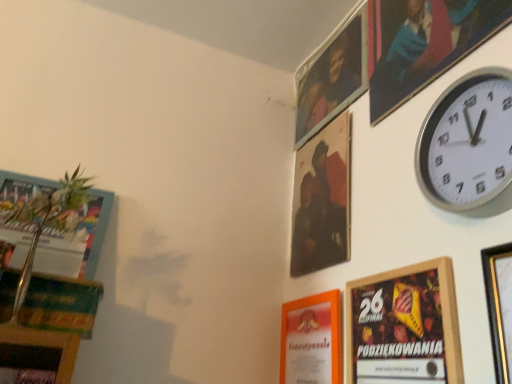
Find the location of a particular element. The width and height of the screenshot is (512, 384). gold metallic picture frame at upper right, which is the 6th picture frame from back to front is located at coordinates (499, 306).

I want to click on metallic silver picture frame at upper right, the sixth picture frame in the front-to-back sequence, so click(332, 75).

The image size is (512, 384). What do you see at coordinates (424, 43) in the screenshot?
I see `wooden picture frame at upper right, the fourth picture frame positioned from the back` at bounding box center [424, 43].

Describe the element at coordinates (467, 141) in the screenshot. Image resolution: width=512 pixels, height=384 pixels. I see `silver metallic wall clock at upper right` at that location.

Image resolution: width=512 pixels, height=384 pixels. I want to click on orange paper at lower center, placed as the 3th picture frame when sorted from back to front, so click(312, 340).

Describe the element at coordinates (312, 340) in the screenshot. I see `orange paper at lower center, the 4th picture frame from the front` at that location.

Identify the location of gold metallic picture frame at upper right, which is the 6th picture frame from back to front. This screenshot has width=512, height=384. (499, 306).

Is point (464, 30) behind point (318, 220)?

That is False.

Can you see wooden picture frame at upper right, which appears as the 3th picture frame when viewed from the front, touching matte black portrait at upper center, which appears as the 2th picture frame when viewed from the back?

No, wooden picture frame at upper right, which appears as the 3th picture frame when viewed from the front, is not next to matte black portrait at upper center, which appears as the 2th picture frame when viewed from the back.

Could matte black portrait at upper center, which appears as the 2th picture frame when viewed from the back, be considered to be inside wooden picture frame at upper right, which appears as the 3th picture frame when viewed from the front?

No, matte black portrait at upper center, which appears as the 2th picture frame when viewed from the back, is located outside of wooden picture frame at upper right, which appears as the 3th picture frame when viewed from the front.

Does point (349, 85) come closer to viewer compared to point (336, 322)?

No, it is behind (336, 322).

Is metallic silver picture frame at upper right, the sixth picture frame in the front-to-back sequence, not close to orange paper at lower center, placed as the 3th picture frame when sorted from back to front?

No, metallic silver picture frame at upper right, the sixth picture frame in the front-to-back sequence, is not far away from orange paper at lower center, placed as the 3th picture frame when sorted from back to front.

Between metallic silver picture frame at upper right, which is the first picture frame from back to front, and orange paper at lower center, the 4th picture frame from the front, which one has more height?

With more height is orange paper at lower center, the 4th picture frame from the front.

Considering the sizes of metallic silver picture frame at upper right, the sixth picture frame in the front-to-back sequence, and orange paper at lower center, placed as the 3th picture frame when sorted from back to front, in the image, is metallic silver picture frame at upper right, the sixth picture frame in the front-to-back sequence, wider or thinner than orange paper at lower center, placed as the 3th picture frame when sorted from back to front,?

Considering their sizes, metallic silver picture frame at upper right, the sixth picture frame in the front-to-back sequence, looks broader than orange paper at lower center, placed as the 3th picture frame when sorted from back to front.

Which object is further away from the camera, orange paper at lower center, the 4th picture frame from the front, or wooden framed poster at lower right, placed as the 2th picture frame when sorted from front to back?

orange paper at lower center, the 4th picture frame from the front, is further from the camera.

Between point (333, 320) and point (359, 298), which one is positioned in front?

Positioned in front is point (359, 298).

From a real-world perspective, is orange paper at lower center, the 4th picture frame from the front, physically above wooden framed poster at lower right, which appears as the 5th picture frame when viewed from the back?

Actually, orange paper at lower center, the 4th picture frame from the front, is physically below wooden framed poster at lower right, which appears as the 5th picture frame when viewed from the back, in the real world.

Which of these two, orange paper at lower center, the 4th picture frame from the front, or wooden framed poster at lower right, which appears as the 5th picture frame when viewed from the back, is wider?

orange paper at lower center, the 4th picture frame from the front.

Is metallic silver picture frame at upper right, which is the first picture frame from back to front, aimed at silver metallic wall clock at upper right?

No, metallic silver picture frame at upper right, which is the first picture frame from back to front, is not turned towards silver metallic wall clock at upper right.

In the scene shown: Which of these two, metallic silver picture frame at upper right, the sixth picture frame in the front-to-back sequence, or silver metallic wall clock at upper right, is thinner?

With smaller width is metallic silver picture frame at upper right, the sixth picture frame in the front-to-back sequence.

Is metallic silver picture frame at upper right, the sixth picture frame in the front-to-back sequence, next to silver metallic wall clock at upper right?

No, metallic silver picture frame at upper right, the sixth picture frame in the front-to-back sequence, is not in contact with silver metallic wall clock at upper right.

Consider the image. Is wooden picture frame at upper right, which appears as the 3th picture frame when viewed from the front, positioned with its back to silver metallic wall clock at upper right?

No, wooden picture frame at upper right, which appears as the 3th picture frame when viewed from the front, is not facing away from silver metallic wall clock at upper right.

From the picture: Who is bigger, wooden picture frame at upper right, which appears as the 3th picture frame when viewed from the front, or silver metallic wall clock at upper right?

Bigger between the two is wooden picture frame at upper right, which appears as the 3th picture frame when viewed from the front.

The image size is (512, 384). I want to click on wall clock lying on the left of wooden picture frame at upper right, which appears as the 3th picture frame when viewed from the front, so click(467, 141).

Which object is further away from the camera, wooden framed poster at lower right, which appears as the 5th picture frame when viewed from the back, or wooden picture frame at upper right, the fourth picture frame positioned from the back?

Positioned behind is wooden picture frame at upper right, the fourth picture frame positioned from the back.

Is wooden framed poster at lower right, which appears as the 5th picture frame when viewed from the back, touching wooden picture frame at upper right, the fourth picture frame positioned from the back?

No, wooden framed poster at lower right, which appears as the 5th picture frame when viewed from the back, is not in contact with wooden picture frame at upper right, the fourth picture frame positioned from the back.

Is wooden framed poster at lower right, which appears as the 5th picture frame when viewed from the back, aimed at wooden picture frame at upper right, the fourth picture frame positioned from the back?

No, wooden framed poster at lower right, which appears as the 5th picture frame when viewed from the back, does not turn towards wooden picture frame at upper right, the fourth picture frame positioned from the back.

Is wooden framed poster at lower right, which appears as the 5th picture frame when viewed from the back, to the left of wooden picture frame at upper right, which appears as the 3th picture frame when viewed from the front, from the viewer's perspective?

Yes.

Considering the sizes of metallic silver picture frame at upper right, the sixth picture frame in the front-to-back sequence, and wooden framed poster at lower right, which appears as the 5th picture frame when viewed from the back, in the image, is metallic silver picture frame at upper right, the sixth picture frame in the front-to-back sequence, bigger or smaller than wooden framed poster at lower right, which appears as the 5th picture frame when viewed from the back,?

metallic silver picture frame at upper right, the sixth picture frame in the front-to-back sequence, is bigger than wooden framed poster at lower right, which appears as the 5th picture frame when viewed from the back.

In the scene shown: From a real-world perspective, is metallic silver picture frame at upper right, the sixth picture frame in the front-to-back sequence, above or below wooden framed poster at lower right, which appears as the 5th picture frame when viewed from the back?

In terms of real-world spatial position, metallic silver picture frame at upper right, the sixth picture frame in the front-to-back sequence, is above wooden framed poster at lower right, which appears as the 5th picture frame when viewed from the back.

Which point is more forward, (298, 77) or (394, 352)?

The point (394, 352) is more forward.

Which object is wider, metallic silver picture frame at upper right, the sixth picture frame in the front-to-back sequence, or wooden framed poster at lower right, placed as the 2th picture frame when sorted from front to back?

metallic silver picture frame at upper right, the sixth picture frame in the front-to-back sequence, is wider.

The width and height of the screenshot is (512, 384). I want to click on the 2nd picture frame behind the wooden picture frame at upper right, the fourth picture frame positioned from the back, starting your count from the anchor, so click(x=322, y=200).

Locate an element on the screen. Image resolution: width=512 pixels, height=384 pixels. the 4th picture frame below when counting from the metallic silver picture frame at upper right, the sixth picture frame in the front-to-back sequence (from the image's perspective) is located at coordinates (312, 340).

Estimate the real-world distances between objects in this image. Which object is further from wooden picture frame at upper right, which appears as the 3th picture frame when viewed from the front, silver metallic wall clock at upper right or gold metallic picture frame at upper right, the first picture frame when ordered from front to back?

gold metallic picture frame at upper right, the first picture frame when ordered from front to back, is positioned further to the anchor wooden picture frame at upper right, which appears as the 3th picture frame when viewed from the front.

When comparing their distances from silver metallic wall clock at upper right, does wooden framed poster at lower right, placed as the 2th picture frame when sorted from front to back, or matte black portrait at upper center, which appears as the 2th picture frame when viewed from the back, seem further?

The object further to silver metallic wall clock at upper right is matte black portrait at upper center, which appears as the 2th picture frame when viewed from the back.

Looking at the image, which one is located further to silver metallic wall clock at upper right, metallic silver picture frame at upper right, the sixth picture frame in the front-to-back sequence, or wooden framed poster at lower right, placed as the 2th picture frame when sorted from front to back?

metallic silver picture frame at upper right, the sixth picture frame in the front-to-back sequence.

Based on their spatial positions, is orange paper at lower center, placed as the 3th picture frame when sorted from back to front, or wooden framed poster at lower right, which appears as the 5th picture frame when viewed from the back, closer to gold metallic picture frame at upper right, which is the 6th picture frame from back to front?

wooden framed poster at lower right, which appears as the 5th picture frame when viewed from the back, lies closer to gold metallic picture frame at upper right, which is the 6th picture frame from back to front, than the other object.

When comparing their distances from silver metallic wall clock at upper right, does gold metallic picture frame at upper right, the first picture frame when ordered from front to back, or wooden picture frame at upper right, the fourth picture frame positioned from the back, seem closer?

gold metallic picture frame at upper right, the first picture frame when ordered from front to back, is positioned closer to the anchor silver metallic wall clock at upper right.

Based on the photo, considering their positions, is orange paper at lower center, placed as the 3th picture frame when sorted from back to front, positioned closer to matte black portrait at upper center, which is counted as the fifth picture frame, starting from the front, than silver metallic wall clock at upper right?

orange paper at lower center, placed as the 3th picture frame when sorted from back to front.

Estimate the real-world distances between objects in this image. Which object is further from orange paper at lower center, placed as the 3th picture frame when sorted from back to front, wooden picture frame at upper right, the fourth picture frame positioned from the back, or metallic silver picture frame at upper right, the sixth picture frame in the front-to-back sequence?

metallic silver picture frame at upper right, the sixth picture frame in the front-to-back sequence, is positioned further to the anchor orange paper at lower center, placed as the 3th picture frame when sorted from back to front.

When comparing their distances from matte black portrait at upper center, which appears as the 2th picture frame when viewed from the back, does silver metallic wall clock at upper right or orange paper at lower center, the 4th picture frame from the front, seem closer?

Based on the image, orange paper at lower center, the 4th picture frame from the front, appears to be nearer to matte black portrait at upper center, which appears as the 2th picture frame when viewed from the back.

At what (x,y) coordinates should I click in order to perform the action: click on wall clock between gold metallic picture frame at upper right, which is the 6th picture frame from back to front, and metallic silver picture frame at upper right, which is the first picture frame from back to front, from front to back. Please return your answer as a coordinate pair (x, y). The width and height of the screenshot is (512, 384). Looking at the image, I should click on 467,141.

This screenshot has width=512, height=384. I want to click on wall clock between wooden picture frame at upper right, which appears as the 3th picture frame when viewed from the front, and gold metallic picture frame at upper right, the first picture frame when ordered from front to back, from top to bottom, so click(467, 141).

Where is `wall clock positioned between gold metallic picture frame at upper right, the first picture frame when ordered from front to back, and orange paper at lower center, the 4th picture frame from the front, from near to far`? Image resolution: width=512 pixels, height=384 pixels. wall clock positioned between gold metallic picture frame at upper right, the first picture frame when ordered from front to back, and orange paper at lower center, the 4th picture frame from the front, from near to far is located at coordinates (467, 141).

This screenshot has width=512, height=384. I want to click on wall clock between metallic silver picture frame at upper right, the sixth picture frame in the front-to-back sequence, and orange paper at lower center, placed as the 3th picture frame when sorted from back to front, in the vertical direction, so click(x=467, y=141).